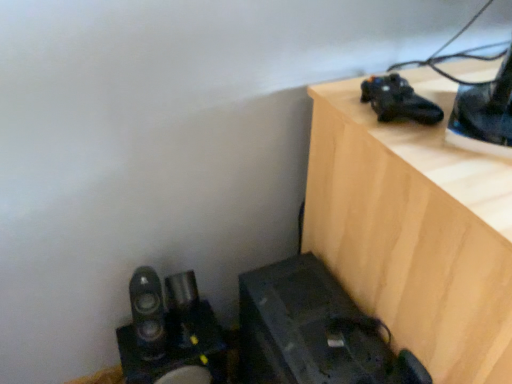
Image resolution: width=512 pixels, height=384 pixels. Identify the location of free space to the right of black matte shoe at upper right. (454, 90).